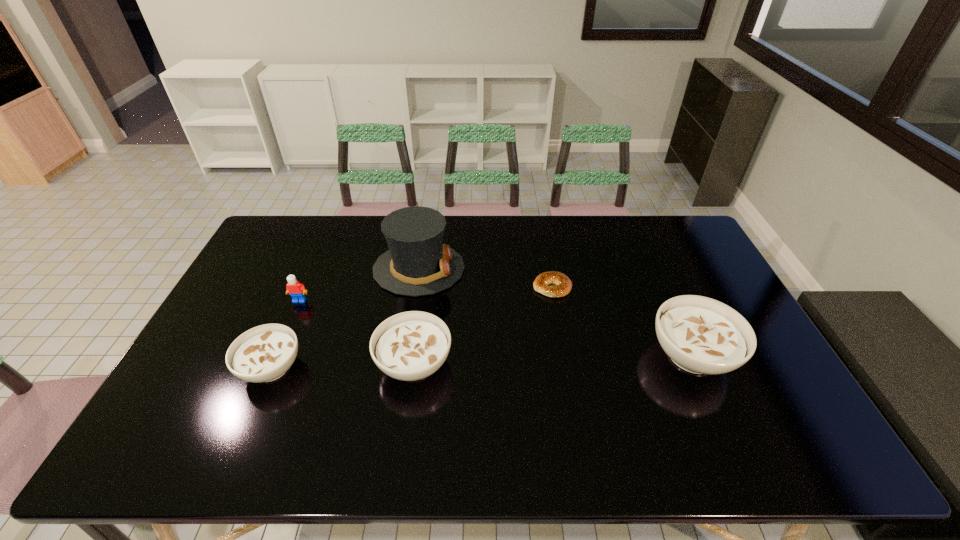
At what (x,y) coordinates should I click in order to perform the action: click on vacant region located on the left of the rightmost soup bowl. Please return your answer as a coordinate pair (x, y). Looking at the image, I should click on (584, 355).

Find the location of `free region located 0.400m on the right of the second object from right to left`. free region located 0.400m on the right of the second object from right to left is located at coordinates (695, 287).

You are a GUI agent. You are given a task and a screenshot of the screen. Output one action in this format:
    pyautogui.click(x=<x>, y=<y>)
    Task: Click on the vacant point located with goggles on the front of the tallest object
    The height and width of the screenshot is (540, 960).
    Given the screenshot: What is the action you would take?
    pyautogui.click(x=562, y=269)

You are a GUI agent. You are given a task and a screenshot of the screen. Output one action in this format:
    pyautogui.click(x=<x>, y=<y>)
    Task: Click on the free space located on the face of the Lego
    
    Given the screenshot: What is the action you would take?
    [281, 343]

Where is `object present at the far edge`? The width and height of the screenshot is (960, 540). object present at the far edge is located at coordinates (417, 263).

The height and width of the screenshot is (540, 960). In order to click on object that is positioned at the left edge in this screenshot , I will do tap(264, 353).

Where is `object present at the right edge`? The height and width of the screenshot is (540, 960). object present at the right edge is located at coordinates (701, 335).

Locate an element on the screen. object situated at the near left corner is located at coordinates (264, 353).

You are a GUI agent. You are given a task and a screenshot of the screen. Output one action in this format:
    pyautogui.click(x=<x>, y=<y>)
    Task: Click on the object at the near right corner
    The width and height of the screenshot is (960, 540).
    Given the screenshot: What is the action you would take?
    pyautogui.click(x=701, y=335)

This screenshot has width=960, height=540. What are the coordinates of `vacant space at the far edge` in the screenshot? It's located at (322, 232).